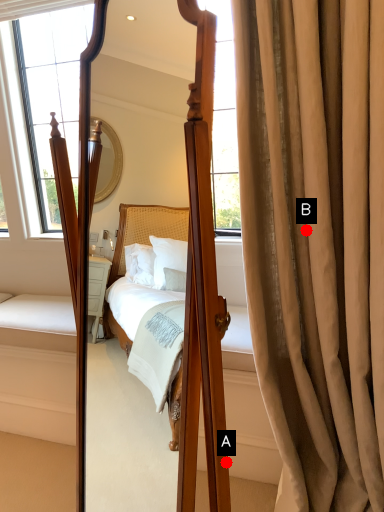
Question: Two points are circled on the image, labeled by A and B beside each circle. Which point is further to the camera?

Choices:
 (A) A is further
 (B) B is further

Answer: (B)